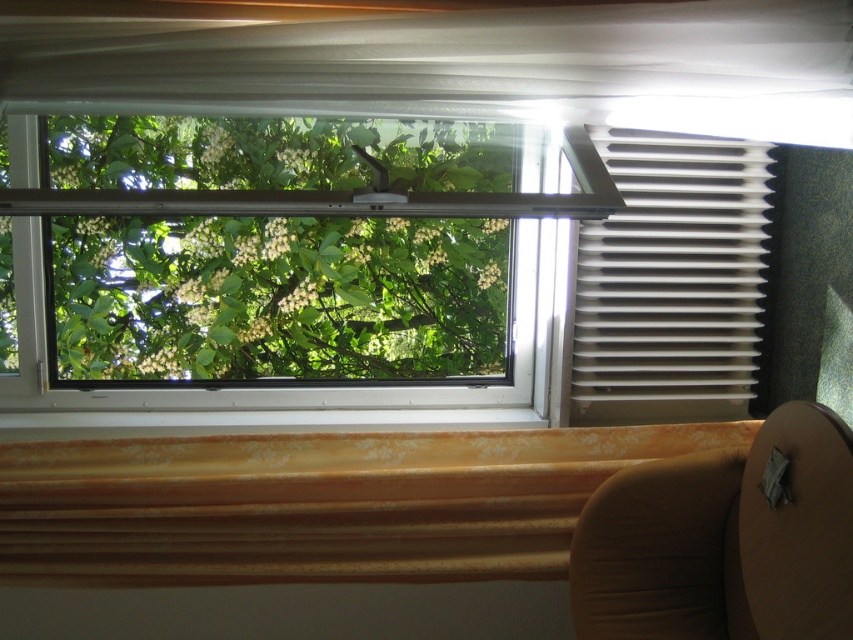
Question: Which of the following is the farthest from the observer?

Choices:
 (A) (379, 355)
 (B) (677, 208)
 (C) (164, 440)

Answer: (A)

Question: Does green leafy tree at center appear on the left side of brown fabric chair at lower right?

Choices:
 (A) no
 (B) yes

Answer: (B)

Question: Can you confirm if green leafy tree at center is positioned to the right of yellow textured curtain at lower center?

Choices:
 (A) no
 (B) yes

Answer: (A)

Question: Is yellow textured curtain at lower center closer to camera compared to brown fabric chair at lower right?

Choices:
 (A) no
 (B) yes

Answer: (A)

Question: Which point appears farthest from the camera in this image?

Choices:
 (A) (430, 161)
 (B) (770, 452)
 (C) (120, 544)
 (D) (637, 257)

Answer: (A)

Question: Which point is closer to the camera?

Choices:
 (A) (515, 497)
 (B) (358, 230)
 (C) (726, 310)

Answer: (A)